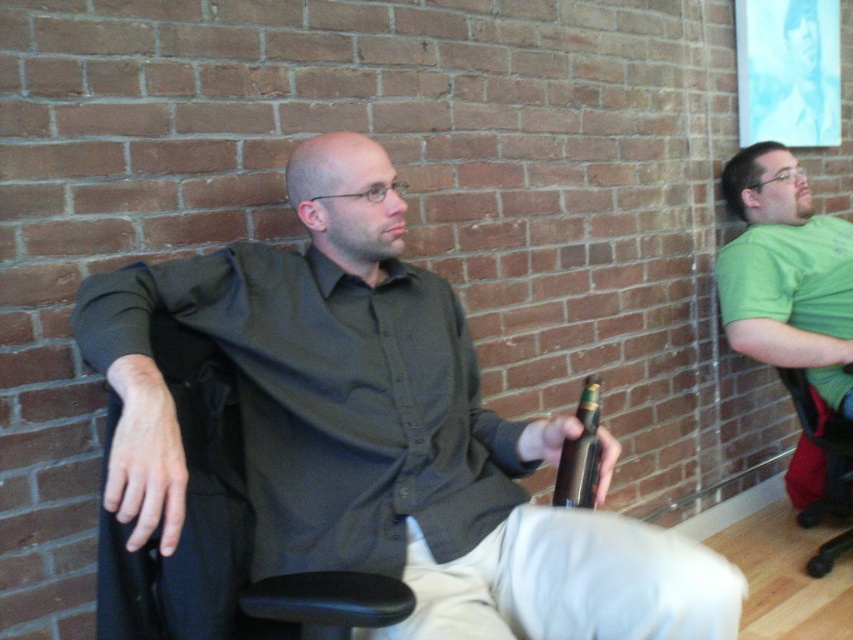
You are standing in the room and want to hand a document to the person wearing the matte black shirt at center. Which direction should you move to approach them?

The matte black shirt at center is located at point (380, 433), so you should move towards the center of the room to reach them.

You are a fashion designer analyzing a photo for a new clothing line. In the image, there are two people. The first person wears a matte black shirt at center and khaki pants at lower center. The second person is wearing a bright green T shirt and a black office chair. Based on the spatial arrangement in the image, which clothing item is positioned higher on the body?

The matte black shirt at center is positioned higher on the body than the khaki pants at lower center because it is described as being above the pants in the image.